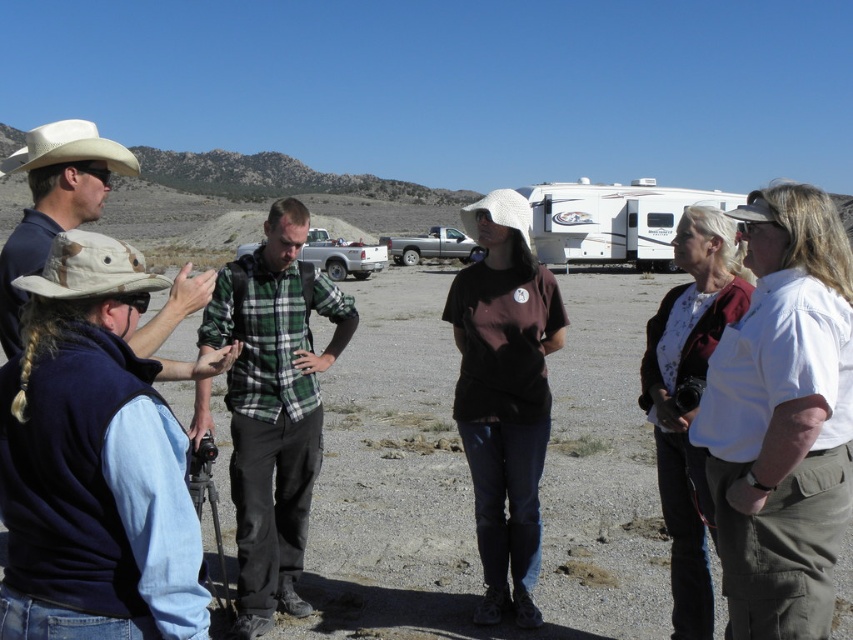
You are standing at the camera position looking at the desert scene. There are two points marked in the image, point A at coordinates point (51, 268) and point B at coordinates point (387, 246). Which point is closer to you?

Point point (51, 268) is closer to the camera than point point (387, 246).

You are standing in the desert scene and want to move from the point closer to you to the farther point. Which path would you take between the two points labeled as point (96, 152) and point (463, 241)?

The path from point (96, 152) to point (463, 241) is the correct route since point (96, 152) is closer to the viewer and you need to move towards the farther point (463, 241).